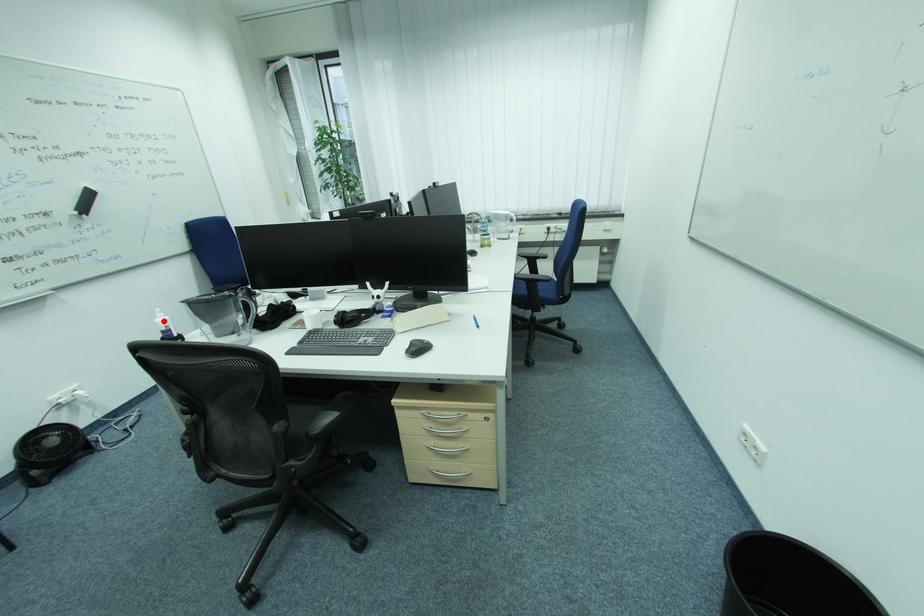
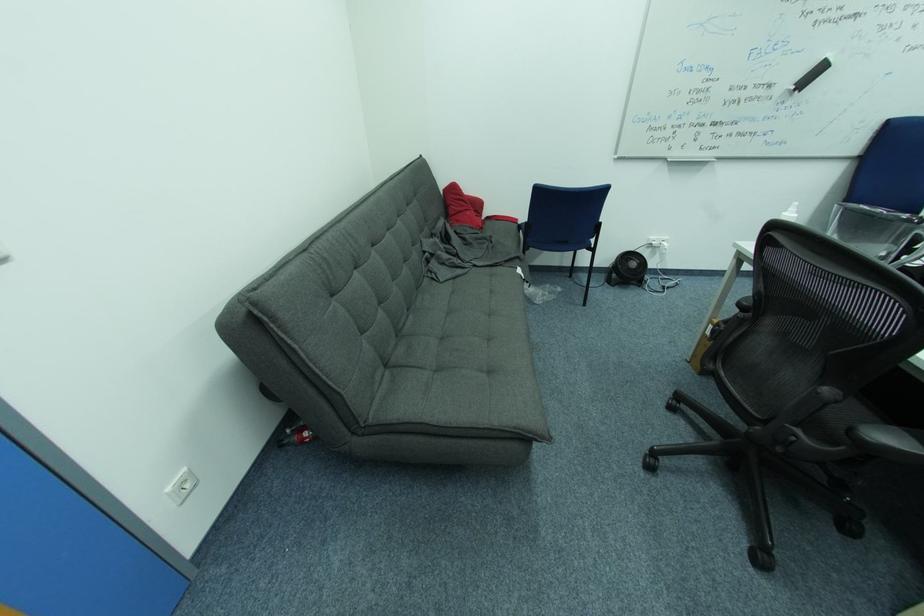
Question: I am providing you with two images of the same scene from different viewpoints. A red point is shown in image1. For the corresponding object point in image2, is it positioned nearer or farther from the camera?

Choices:
 (A) Nearer
 (B) Farther

Answer: (A)